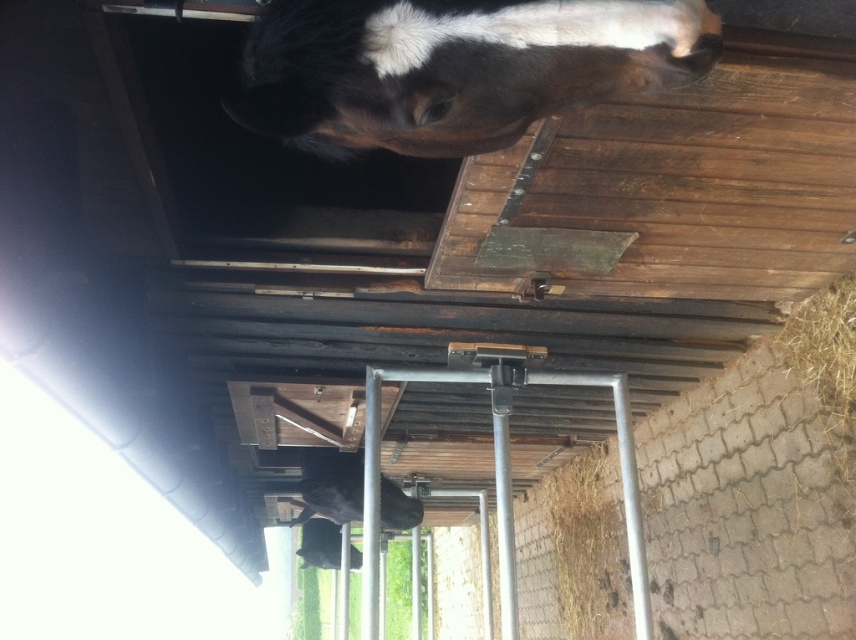
You are standing in a stable and want to approach the black and white fur horse at upper center and the black glossy horse at center. Which horse will you reach first as you move forward?

You will reach the black and white fur horse at upper center first because it is closer to you than the black glossy horse at center.

You are standing at point (287, 4) and want to walk to the metal gate with vertical bars. Is point (385, 483) between you and the metal gate?

Point (287, 4) is in front of point (385, 483), so yes, point (385, 483) is between you and the metal gate.